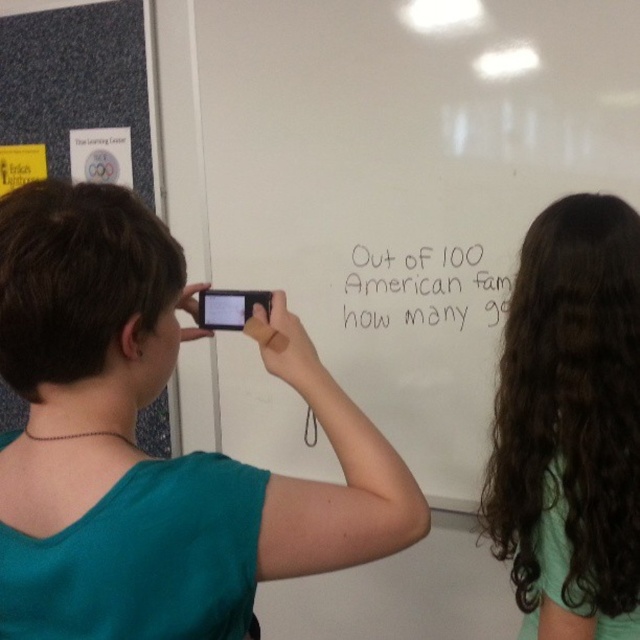
In the scene shown: Is dark brown curly hair at upper right bigger than matte black smartphone at center?

Indeed, dark brown curly hair at upper right has a larger size compared to matte black smartphone at center.

Does point (516, 550) come farther from viewer compared to point (268, 308)?

Yes.

The image size is (640, 640). I want to click on dark brown curly hair at upper right, so click(570, 424).

Based on the photo, is teal fabric shirt at upper left below dark brown curly hair at upper right?

No.

Is point (33, 428) positioned in front of point (589, 376)?

Yes, point (33, 428) is closer to viewer.

Is point (205, 525) positioned in front of point (509, 301)?

That is True.

This screenshot has height=640, width=640. Identify the location of teal fabric shirt at upper left. (145, 452).

Does blue fabric bulletin board at upper left have a lesser width compared to matte black smartphone at center?

In fact, blue fabric bulletin board at upper left might be wider than matte black smartphone at center.

Does point (403, 163) lie behind point (196, 316)?

Yes.

This screenshot has width=640, height=640. What are the coordinates of `blue fabric bulletin board at upper left` in the screenshot? It's located at (403, 188).